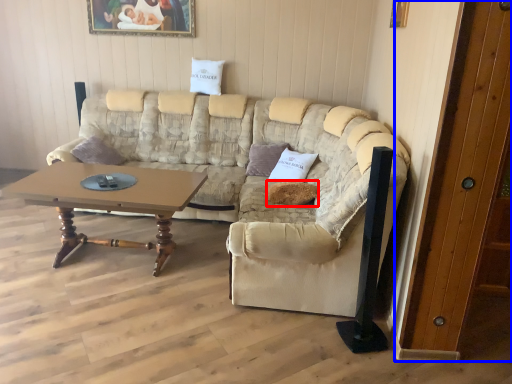
Question: Which object appears farthest to the camera in this image, pillow (highlighted by a red box) or door (highlighted by a blue box)?

Choices:
 (A) pillow
 (B) door

Answer: (A)